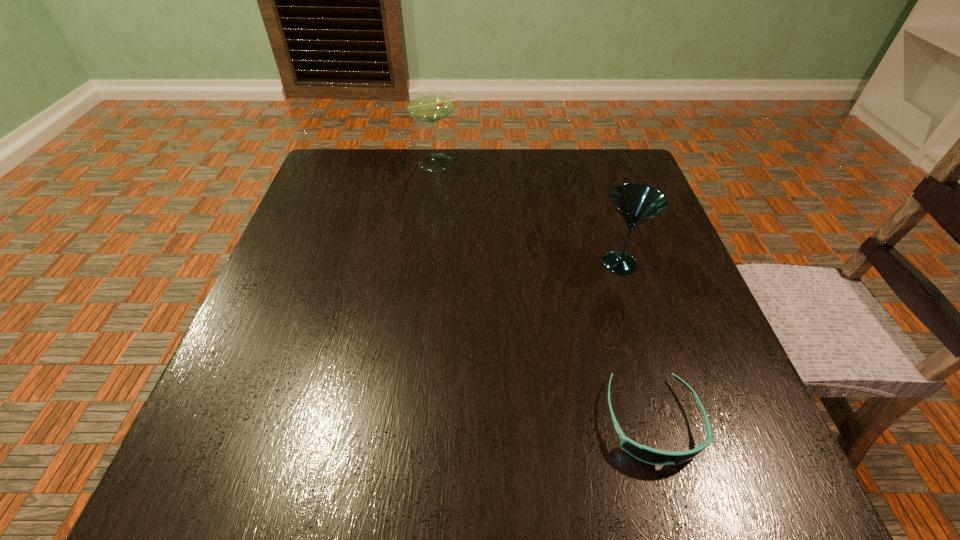
The width and height of the screenshot is (960, 540). Find the location of `the left martini`. the left martini is located at coordinates (432, 104).

The height and width of the screenshot is (540, 960). I want to click on the farther martini, so click(x=432, y=104).

The height and width of the screenshot is (540, 960). In order to click on the right martini in this screenshot , I will do `click(636, 203)`.

Find the location of `the shorter martini`. the shorter martini is located at coordinates (636, 203).

Identify the location of the shortest object. The height and width of the screenshot is (540, 960). (643, 453).

Locate an element on the screen. The width and height of the screenshot is (960, 540). the nearest object is located at coordinates (643, 453).

Image resolution: width=960 pixels, height=540 pixels. Find the location of `blank space located on the right of the farthest object`. blank space located on the right of the farthest object is located at coordinates (555, 163).

Find the location of a particular element. The image size is (960, 540). vacant space situated on the back of the second tallest object is located at coordinates (585, 152).

The height and width of the screenshot is (540, 960). Identify the location of object at the far edge. (432, 104).

At what (x,y) coordinates should I click in order to perform the action: click on object at the near edge. Please return your answer as a coordinate pair (x, y). The width and height of the screenshot is (960, 540). Looking at the image, I should click on (643, 453).